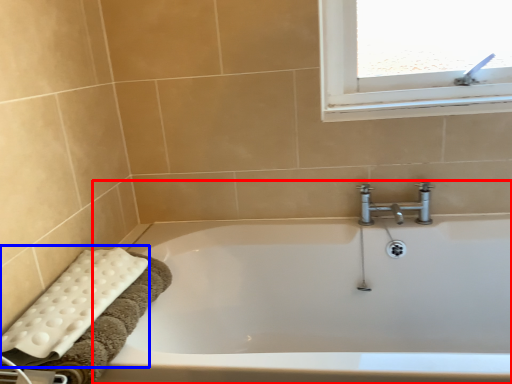
Question: Which of the following is the farthest to the observer, bathtub (highlighted by a red box) or bath towel (highlighted by a blue box)?

Choices:
 (A) bathtub
 (B) bath towel

Answer: (B)